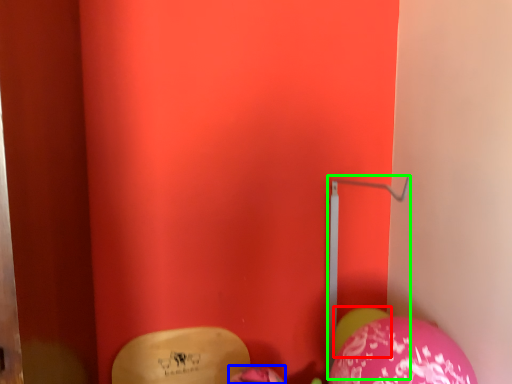
Question: Based on their relative distances, which object is nearer to balloon (highlighted by a red box)? Choose from balloon (highlighted by a blue box) and trim (highlighted by a green box).

Choices:
 (A) balloon
 (B) trim

Answer: (B)